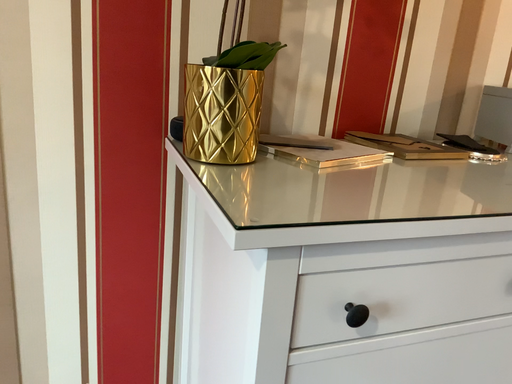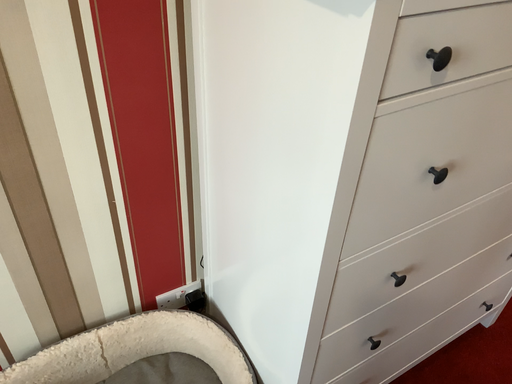
Question: How did the camera likely rotate when shooting the video?

Choices:
 (A) rotated right
 (B) rotated left

Answer: (A)